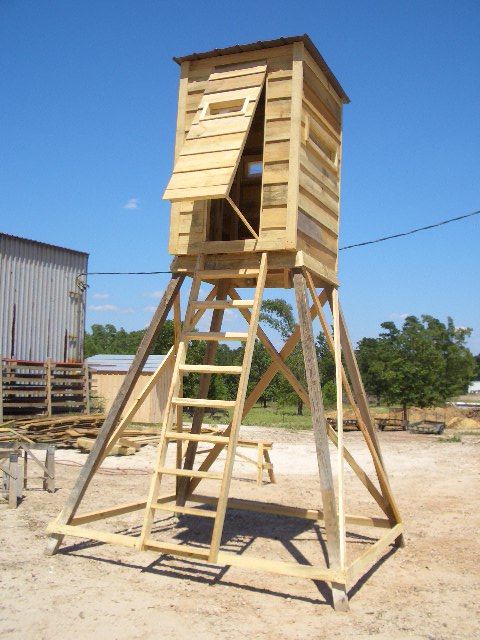
Locate an element on the screen. frame is located at coordinates (83, 476), (328, 476), (370, 420), (202, 387).